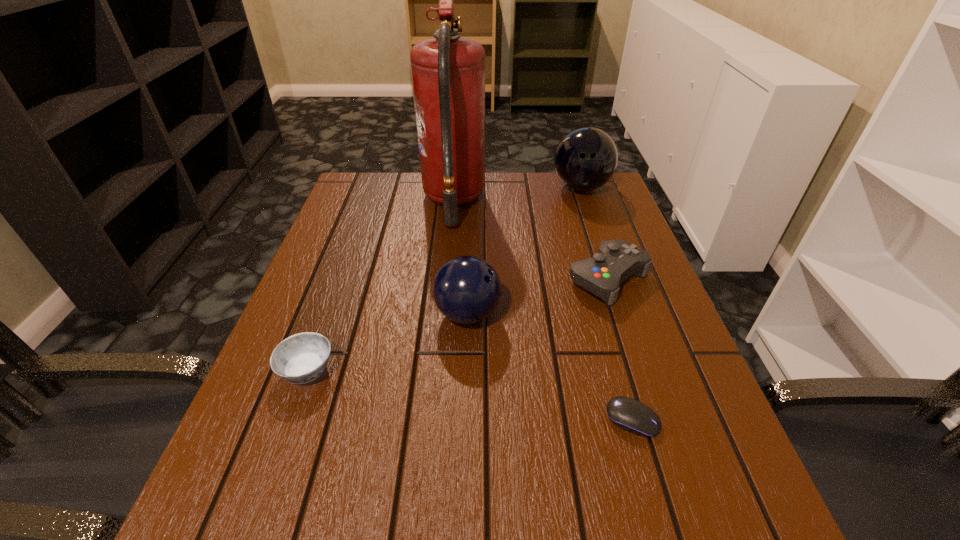
Where is `vacant space in between the right bowling ball and the third shortest object`? vacant space in between the right bowling ball and the third shortest object is located at coordinates (594, 233).

In order to click on empty space that is in between the fire extinguisher and the control in this screenshot , I will do `click(531, 240)`.

What are the coordinates of `vacant region between the right bowling ball and the control` in the screenshot? It's located at (594, 233).

Identify the location of free space between the control and the third tallest object. (539, 296).

You are a GUI agent. You are given a task and a screenshot of the screen. Output one action in this format:
    pyautogui.click(x=<x>, y=<y>)
    Task: Click on the free space between the fifth shortest object and the fire extinguisher
    
    Given the screenshot: What is the action you would take?
    pyautogui.click(x=517, y=194)

Where is `vacant space in between the third shortest object and the fire extinguisher`? This screenshot has height=540, width=960. vacant space in between the third shortest object and the fire extinguisher is located at coordinates (531, 240).

Find the location of a particular element. The image size is (960, 540). free spot between the control and the fire extinguisher is located at coordinates (531, 240).

I want to click on blank region between the fire extinguisher and the third shortest object, so click(531, 240).

Select which object appears as the third closest to the second tallest object. Please provide its 2D coordinates. Your answer should be formatted as a tuple, i.e. [(x, y)], where the tuple contains the x and y coordinates of a point satisfying the conditions above.

[(467, 289)]

Find the location of a particular element. object that stands as the closest to the control is located at coordinates (467, 289).